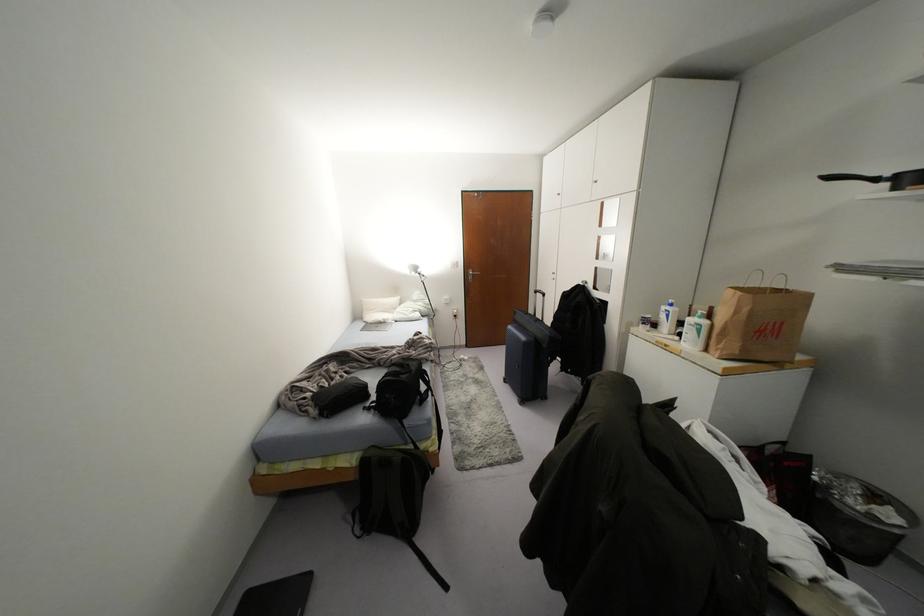
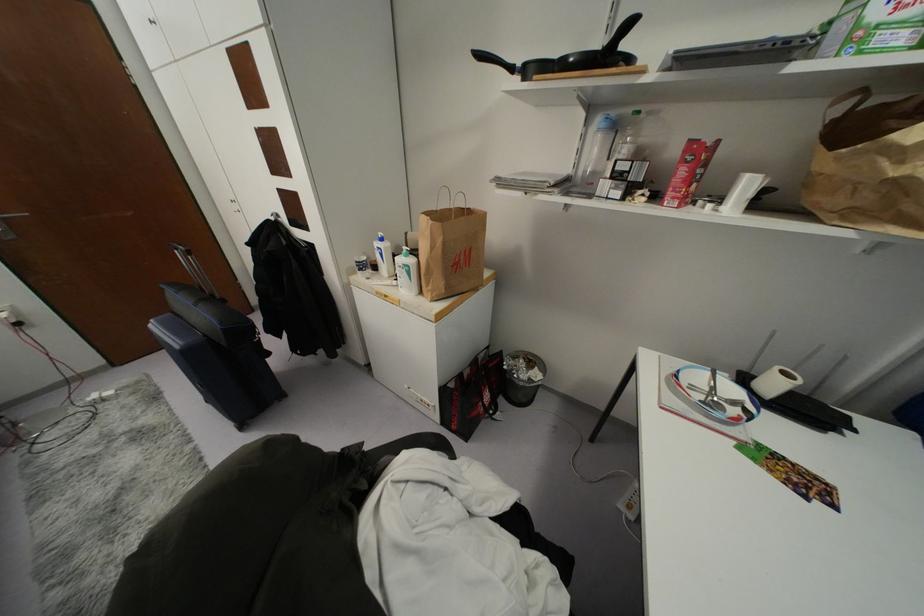
Where in the second image is the point corresponding to the point at 666,315 from the first image?

(381, 254)